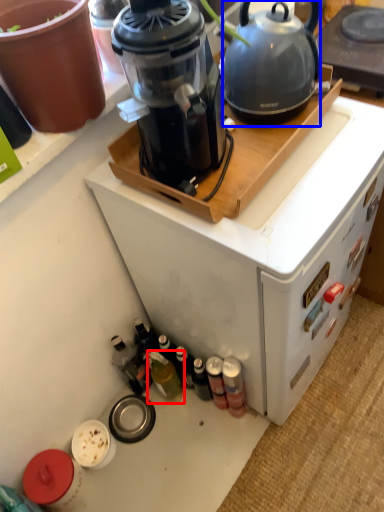
Question: Which point is further to the camera, bottle (highlighted by a red box) or kettle (highlighted by a blue box)?

Choices:
 (A) bottle
 (B) kettle

Answer: (A)